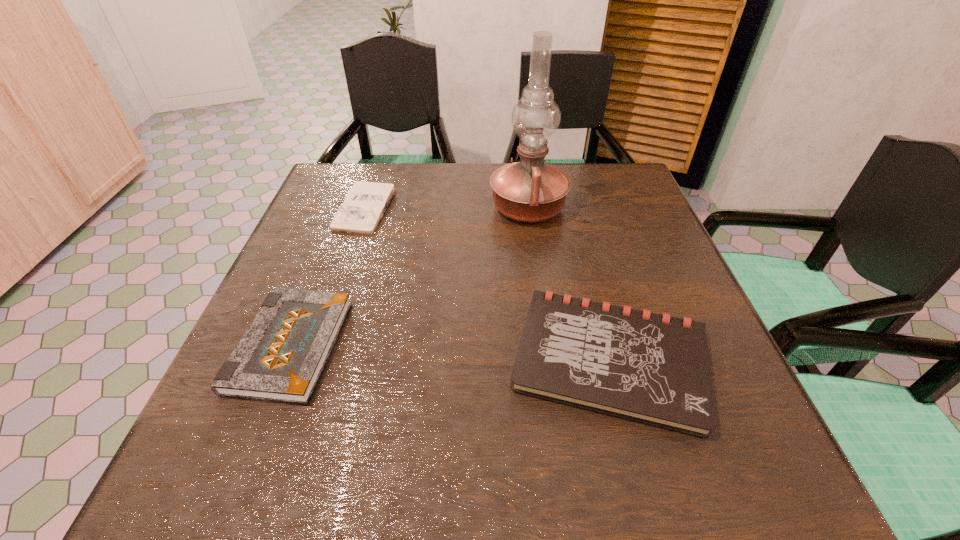
Locate an element on the screen. The width and height of the screenshot is (960, 540). vacant point located between the farthest notebook and the rightmost notebook is located at coordinates (489, 284).

This screenshot has width=960, height=540. What are the coordinates of `vacant region between the tallest object and the rightmost notebook` in the screenshot? It's located at (569, 284).

At what (x,y) coordinates should I click in order to perform the action: click on free space between the tallest object and the farthest notebook. Please return your answer as a coordinate pair (x, y). Looking at the image, I should click on (447, 208).

Where is `empty space between the shortest object and the rightmost notebook`? The image size is (960, 540). empty space between the shortest object and the rightmost notebook is located at coordinates 489,284.

The width and height of the screenshot is (960, 540). I want to click on the second closest object to the shortest object, so click(529, 190).

Select which object appears as the third closest to the tallest object. Please provide its 2D coordinates. Your answer should be formatted as a tuple, i.e. [(x, y)], where the tuple contains the x and y coordinates of a point satisfying the conditions above.

[(281, 356)]

Choose which notebook is the nearest neighbor to the shortest object. Please provide its 2D coordinates. Your answer should be formatted as a tuple, i.e. [(x, y)], where the tuple contains the x and y coordinates of a point satisfying the conditions above.

[(281, 356)]

Where is `notebook that stands as the closest to the shortest notebook`? notebook that stands as the closest to the shortest notebook is located at coordinates (281, 356).

Where is `vacant space that satisfies the following two spatial constraints: 1. on the front side of the tallest object; 2. on the left side of the rightmost notebook`? vacant space that satisfies the following two spatial constraints: 1. on the front side of the tallest object; 2. on the left side of the rightmost notebook is located at coordinates (549, 360).